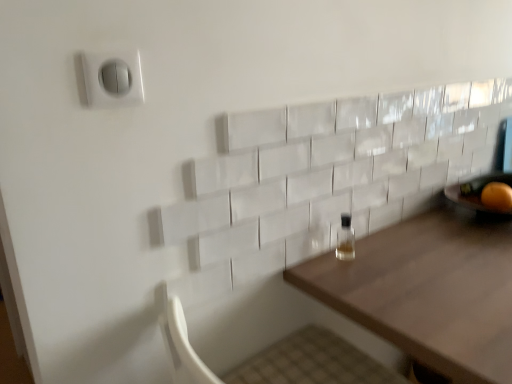
This screenshot has height=384, width=512. What are the coordinates of `vacant space to the right of clear glass bottle at center` in the screenshot? It's located at (414, 256).